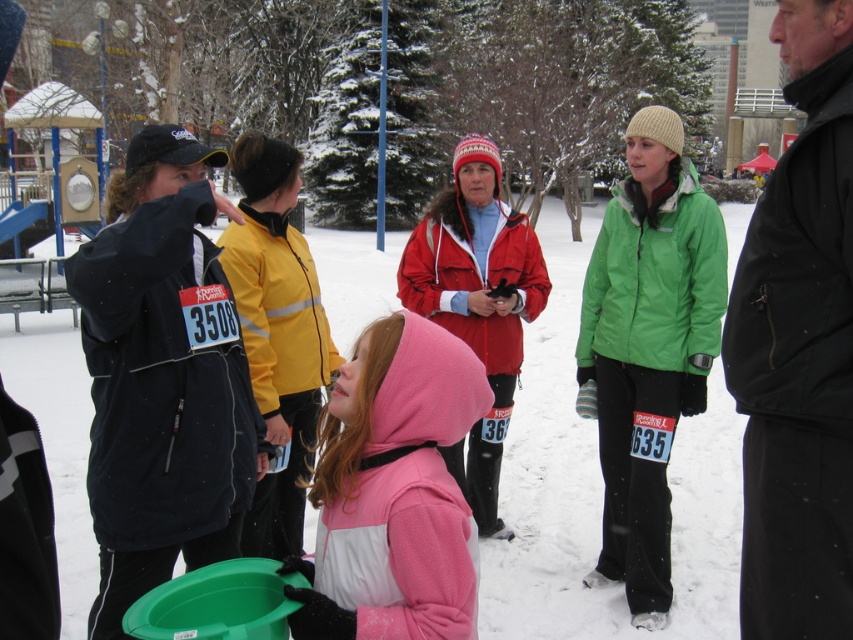
Question: Is black matte jacket at center in front of matte red jacket at center?

Choices:
 (A) yes
 (B) no

Answer: (A)

Question: Is black matte jacket at center bigger than green matte jacket at center?

Choices:
 (A) yes
 (B) no

Answer: (B)

Question: Can you confirm if black matte jacket at center is bigger than matte red jacket at center?

Choices:
 (A) yes
 (B) no

Answer: (B)

Question: Which object is closer to the camera taking this photo?

Choices:
 (A) green matte jacket at center
 (B) pink fleece jacket at center
 (C) black matte jacket at center
 (D) matte red jacket at center

Answer: (B)

Question: Which point is closer to the camera?

Choices:
 (A) (643, 109)
 (B) (361, 442)
 (C) (844, 538)

Answer: (B)

Question: Which is nearer to the pink fleece jacket at center?

Choices:
 (A) matte red jacket at center
 (B) green matte jacket at center
 (C) black matte jacket at center

Answer: (C)